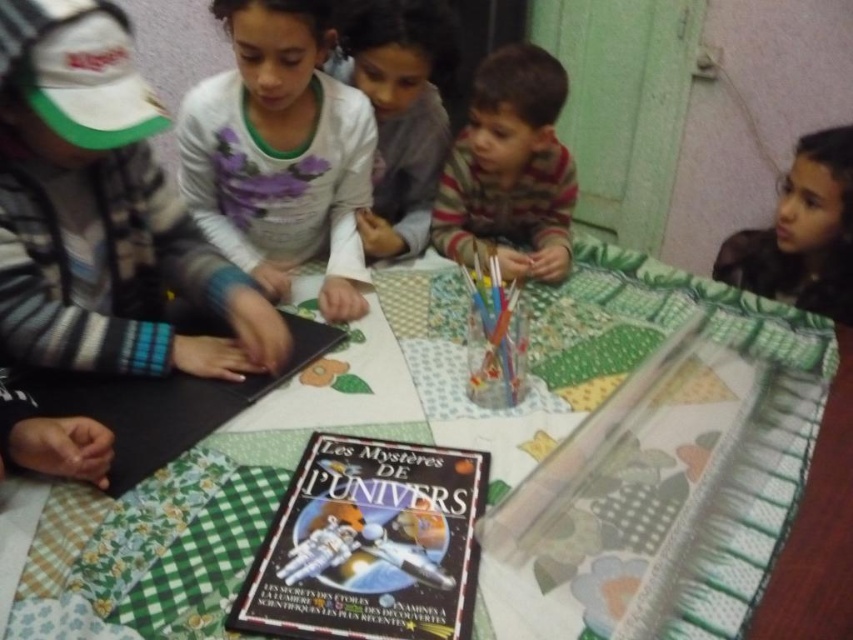
Question: Which point appears farthest from the camera in this image?

Choices:
 (A) (253, 454)
 (B) (398, 212)

Answer: (B)

Question: Does white soft shirt at center appear over matte white shirt at upper center?

Choices:
 (A) yes
 (B) no

Answer: (B)

Question: Which of the following is the closest to the observer?

Choices:
 (A) (415, 406)
 (B) (851, 308)
 (C) (102, 381)

Answer: (A)

Question: Can you confirm if green quilted table at center is smaller than matte white shirt at upper center?

Choices:
 (A) yes
 (B) no

Answer: (B)

Question: Which point is closer to the camera?

Choices:
 (A) (204, 474)
 (B) (407, 605)
 (C) (219, 122)

Answer: (B)

Question: Is striped cotton shirt at center smaller than smooth brown hair at upper right?

Choices:
 (A) yes
 (B) no

Answer: (B)